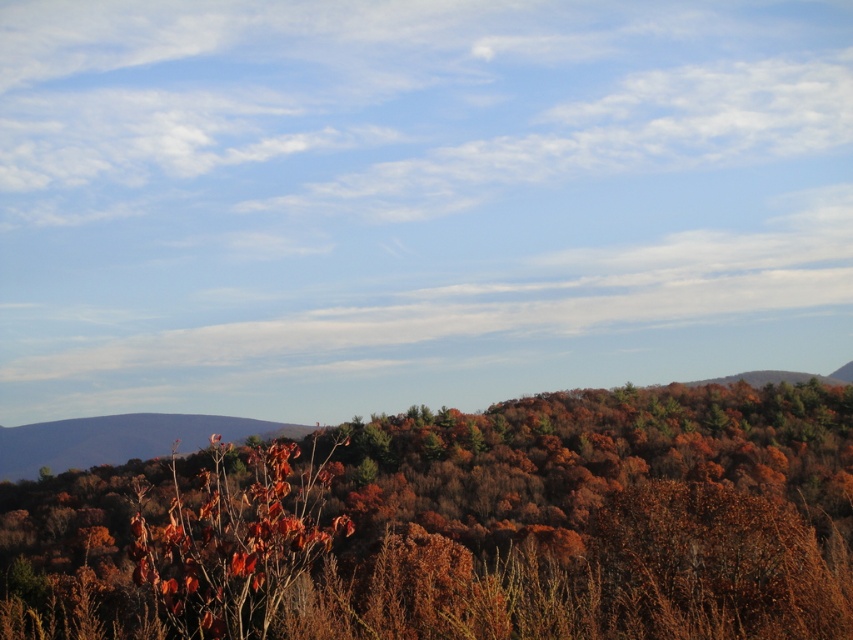
You are an artist sketching the scene and want to ensure proper proportions. Given the brown matte tree at center and the leathery brown leaves at center, which one should you draw larger in your sketch?

The brown matte tree at center should be drawn larger than the leathery brown leaves at center because the brown matte tree at center is bigger than leathery brown leaves at center.

You are standing at the point marked as point (587, 518) in the image. Looking around, you see a brown matte tree at center. What is the nearest object to you?

The nearest object to you is the brown matte tree at center because the point (587, 518) is on it.

You are a hiker standing at the base of the hillside. You notice a brown matte tree at center and leathery brown leaves at center. Which object is taller?

The brown matte tree at center is taller than the leathery brown leaves at center.